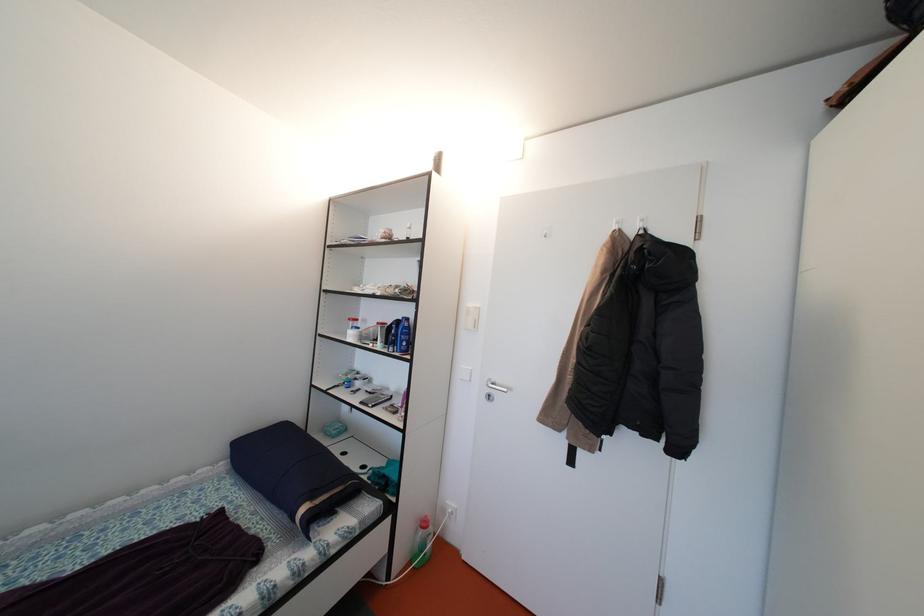
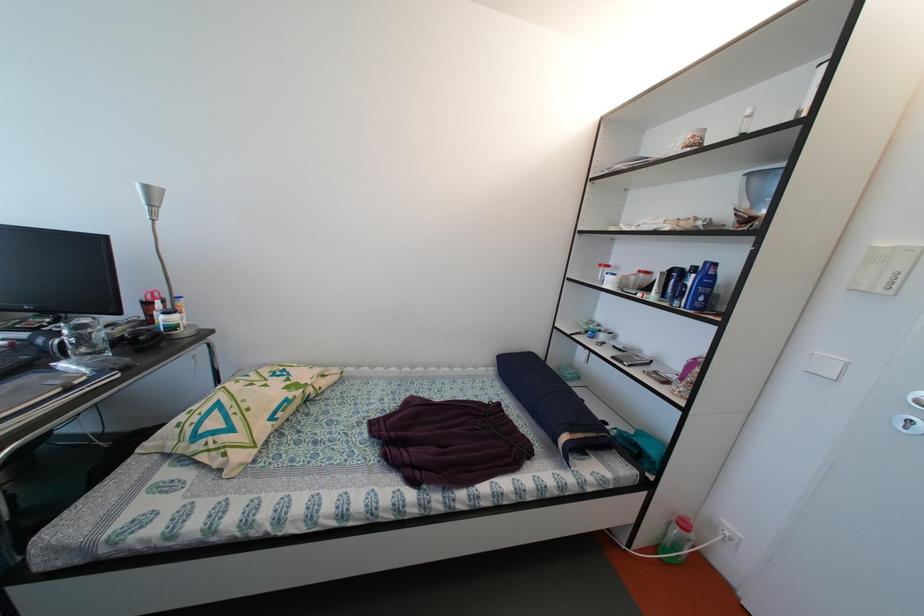
Question: How did the camera likely rotate?

Choices:
 (A) Left
 (B) Right
 (C) Up
 (D) Down

Answer: (A)